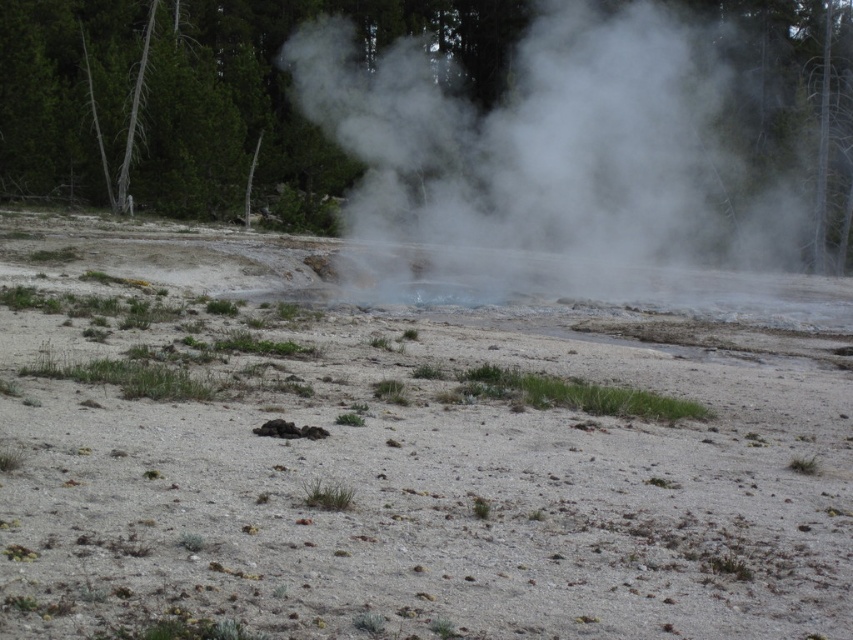
Measure the distance between gray sandy dirt field at center and white vapor steam at center.

gray sandy dirt field at center is 73.56 feet away from white vapor steam at center.

Locate an element on the screen. gray sandy dirt field at center is located at coordinates (401, 454).

Locate an element on the screen. The height and width of the screenshot is (640, 853). gray sandy dirt field at center is located at coordinates (401, 454).